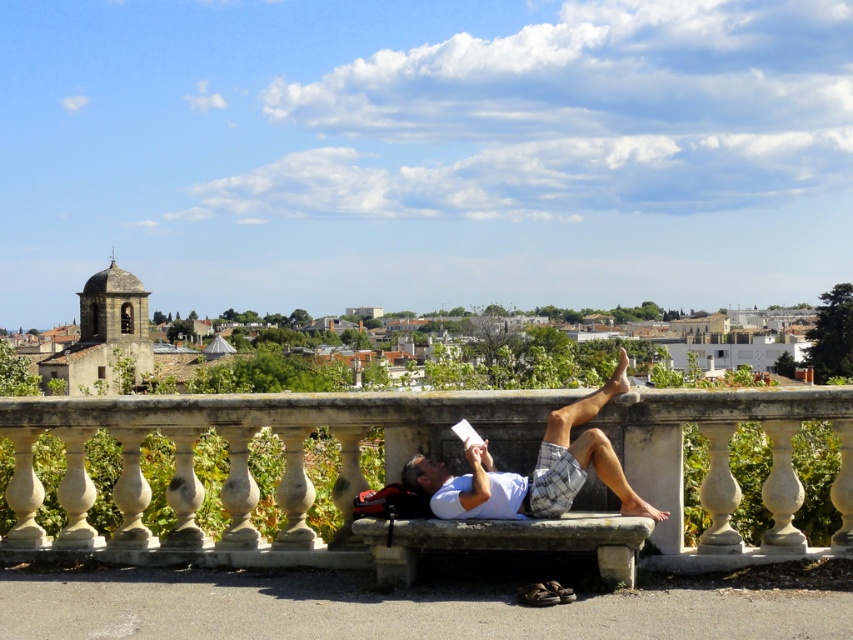
How much distance is there between white stone bench at center and white cotton shirt at center?

The distance of white stone bench at center from white cotton shirt at center is 9.47 feet.

Does white stone bench at center come in front of white cotton shirt at center?

Yes, it is in front of white cotton shirt at center.

The image size is (853, 640). Describe the element at coordinates (241, 467) in the screenshot. I see `white stone bench at center` at that location.

Where is `white stone bench at center`? This screenshot has width=853, height=640. white stone bench at center is located at coordinates (241, 467).